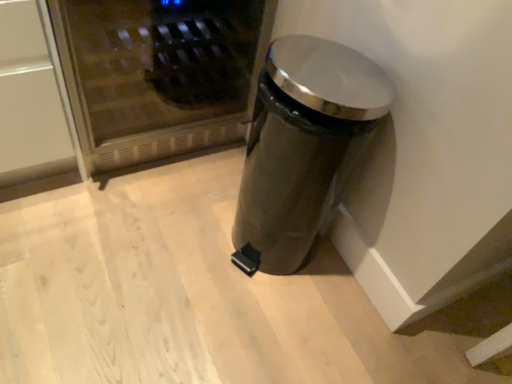
Find the location of a particular element. The width and height of the screenshot is (512, 384). vacant area located to the right-hand side of satin silver trash can at lower right is located at coordinates (339, 296).